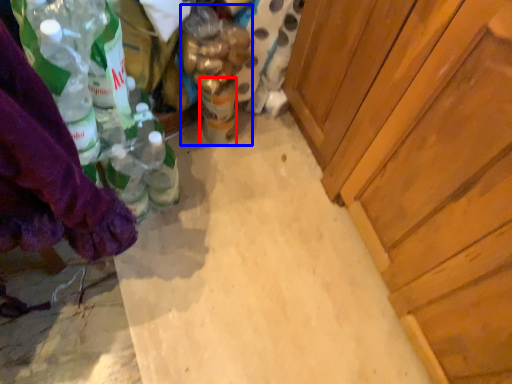
Question: Among these objects, which one is nearest to the camera, beverage (highlighted by a red box) or bottle (highlighted by a blue box)?

Choices:
 (A) beverage
 (B) bottle

Answer: (B)